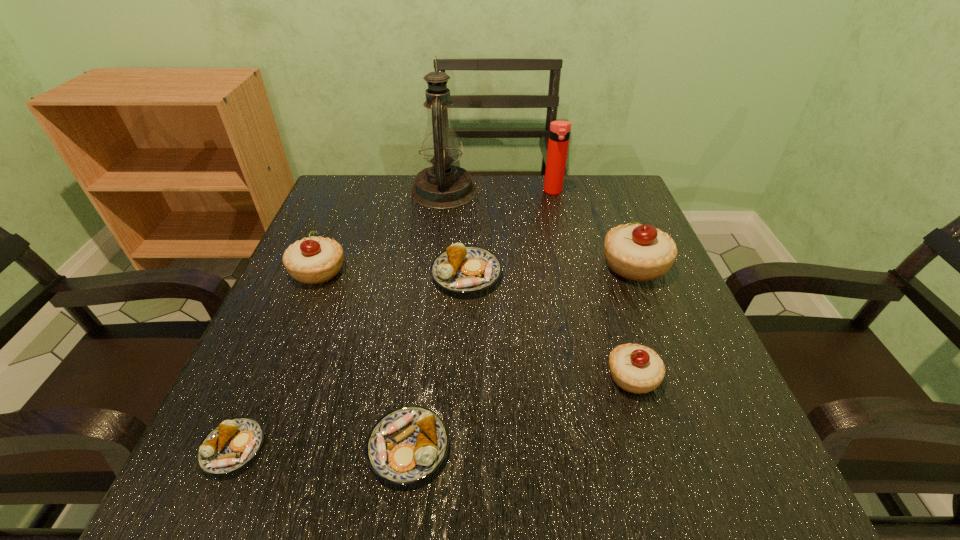
Locate an element on the screen. The width and height of the screenshot is (960, 540). the tallest object is located at coordinates (442, 186).

I want to click on thermos bottle, so click(559, 134).

I want to click on the biggest beige pastry, so click(x=635, y=251).

This screenshot has width=960, height=540. I want to click on the sixth shortest object, so click(x=635, y=251).

Identify the location of the leftmost beige pastry. This screenshot has height=540, width=960. (313, 260).

I want to click on the fourth tallest object, so click(313, 260).

Identify the location of the nearest beige pastry. (635, 368).

You are a GUI agent. You are given a task and a screenshot of the screen. Output one action in this format:
    pyautogui.click(x=<x>, y=<y>)
    Task: Click on the fourth shortest object
    Image resolution: width=960 pixels, height=540 pixels.
    Given the screenshot: What is the action you would take?
    pyautogui.click(x=635, y=368)

The image size is (960, 540). In order to click on the biggest brown pastry in this screenshot , I will do `click(461, 269)`.

Locate an element on the screen. the third shortest pastry is located at coordinates point(461,269).